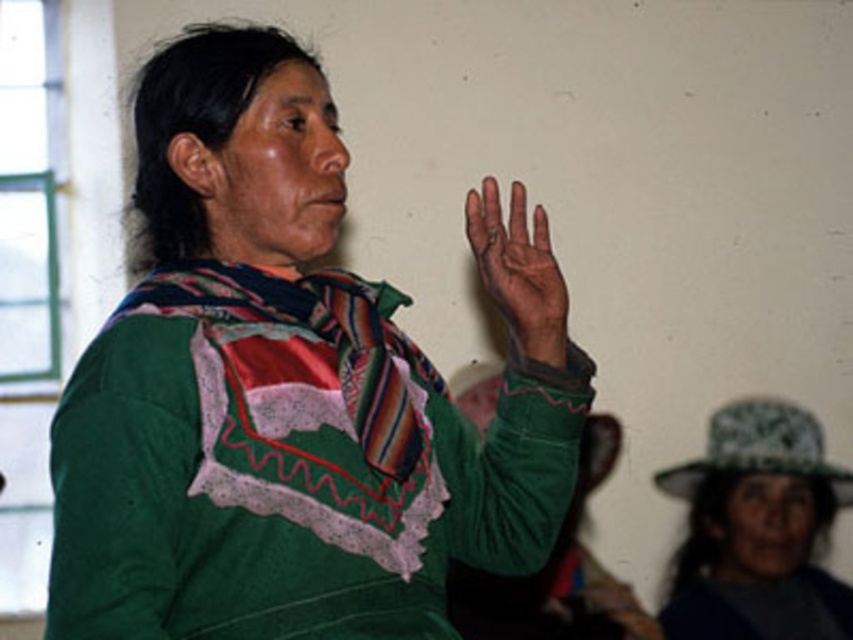
Question: Does camouflage fabric hat at lower right appear on the right side of brown leather hand at upper center?

Choices:
 (A) no
 (B) yes

Answer: (B)

Question: Which point appears closest to the camera in this image?

Choices:
 (A) (711, 595)
 (B) (289, 45)
 (C) (490, 262)

Answer: (B)

Question: Is green soft sweater at center below camouflage fabric hat at lower right?

Choices:
 (A) no
 (B) yes

Answer: (A)

Question: Which point appears closest to the camera in this image?

Choices:
 (A) (712, 538)
 (B) (479, 227)
 (C) (107, 461)

Answer: (C)

Question: Which point is farther to the camera?

Choices:
 (A) camouflage fabric hat at lower right
 (B) brown leather hand at upper center

Answer: (A)

Question: Can you confirm if green soft sweater at center is positioned to the right of camouflage fabric hat at lower right?

Choices:
 (A) no
 (B) yes

Answer: (A)